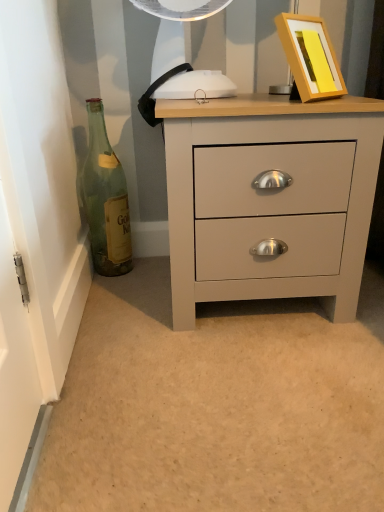
Question: Is point (312, 59) closer or farther from the camera than point (344, 259)?

Choices:
 (A) farther
 (B) closer

Answer: (B)

Question: Would you say yellow matte picture frame at upper right is inside or outside matte gray chest of drawers at center?

Choices:
 (A) inside
 (B) outside

Answer: (B)

Question: Which object is the farthest from the matte gray chest of drawers at center?

Choices:
 (A) green glass bottle at left
 (B) yellow matte picture frame at upper right

Answer: (A)

Question: Which object is the farthest from the green glass bottle at left?

Choices:
 (A) matte gray chest of drawers at center
 (B) yellow matte picture frame at upper right

Answer: (B)